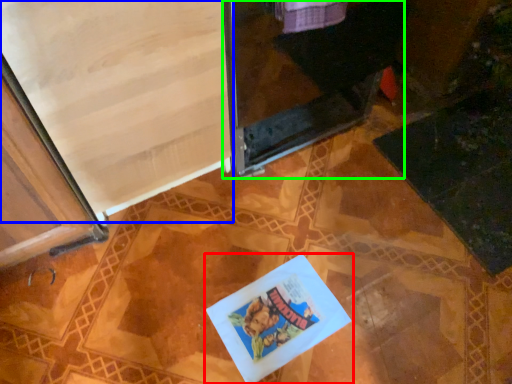
Question: Based on their relative distances, which object is nearer to book (highlighted by a red box)? Choose from screen door (highlighted by a blue box) and screen door (highlighted by a green box).

Choices:
 (A) screen door
 (B) screen door

Answer: (A)